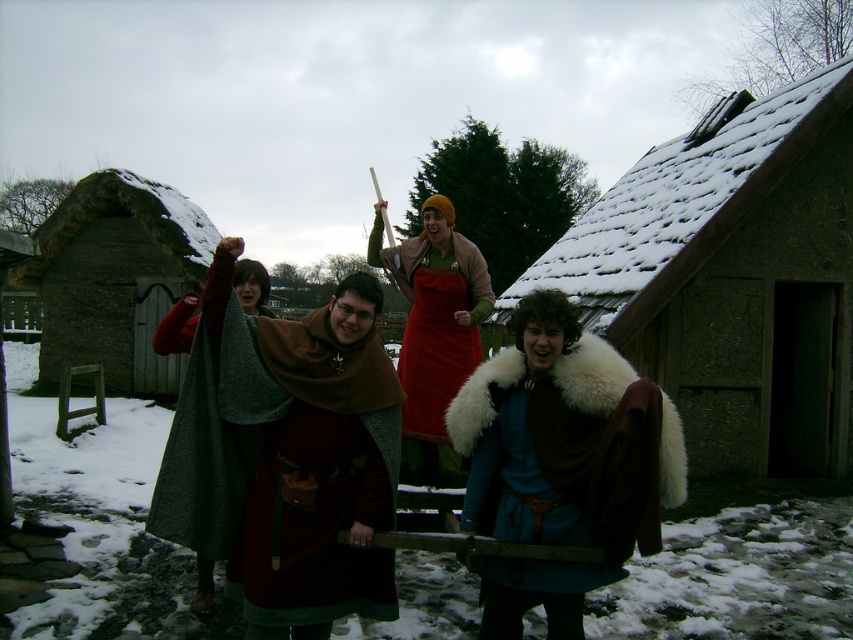
What is located at point (115, 276)?

A dark brown wooden hut at left is located at point (115, 276).